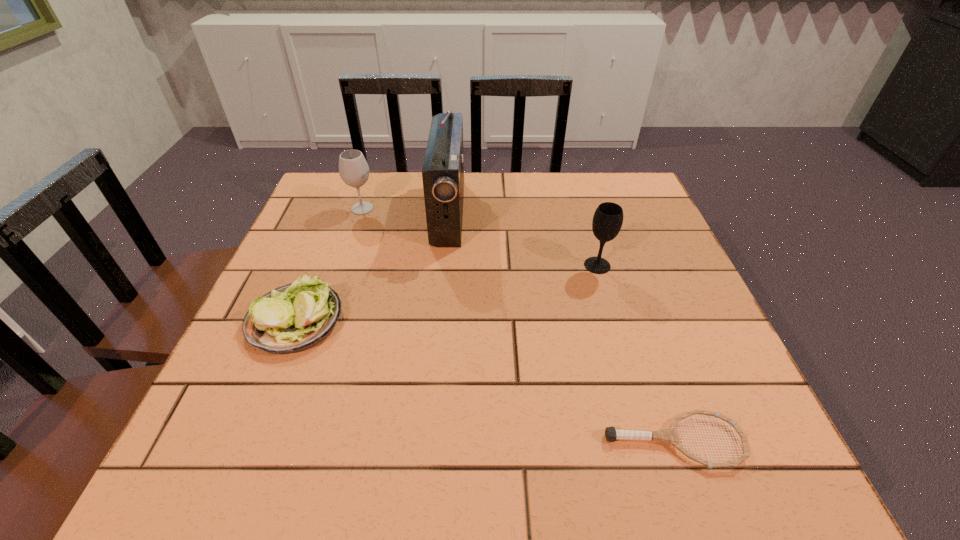
You are a GUI agent. You are given a task and a screenshot of the screen. Output one action in this format:
    pyautogui.click(x=<x>, y=<y>)
    Task: Click on the free point that satisfies the following two spatial constraints: 1. on the front-facing side of the nearer wineglass; 2. on the left side of the tallest object
    
    Given the screenshot: What is the action you would take?
    pyautogui.click(x=444, y=266)

This screenshot has width=960, height=540. Identify the location of free spot that satisfies the following two spatial constraints: 1. on the back side of the right wineglass; 2. on the front-facing side of the tallest object. (582, 213).

This screenshot has height=540, width=960. I want to click on free space that satisfies the following two spatial constraints: 1. on the front-facing side of the third object from right to left; 2. on the left side of the right wineglass, so click(x=444, y=266).

Find the location of a particular element. The image size is (960, 540). blank area in the image that satisfies the following two spatial constraints: 1. on the front-facing side of the nearest object; 2. on the right side of the tallest object is located at coordinates (428, 441).

In order to click on blank space that satisfies the following two spatial constraints: 1. on the back side of the farther wineglass; 2. on the left side of the lettuce in this screenshot , I will do `click(341, 208)`.

The height and width of the screenshot is (540, 960). In order to click on free spot that satisfies the following two spatial constraints: 1. on the back side of the farther wineglass; 2. on the right side of the second nearest object in this screenshot , I will do `click(341, 208)`.

Find the location of `blank space that satisfies the following two spatial constraints: 1. on the front-facing side of the shortest object; 2. on the right side of the tallest object`. blank space that satisfies the following two spatial constraints: 1. on the front-facing side of the shortest object; 2. on the right side of the tallest object is located at coordinates (428, 441).

What are the coordinates of `free point that satisfies the following two spatial constraints: 1. on the front-facing side of the tallest object; 2. on the front side of the second shortest object` in the screenshot? It's located at (439, 319).